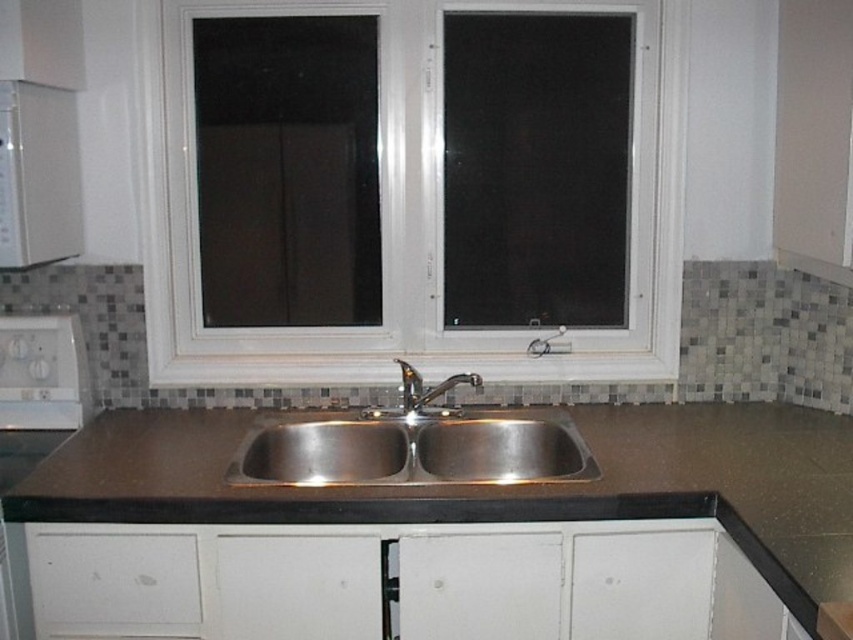
Question: Estimate the real-world distances between objects in this image. Which object is closer to the white plastic window at center?

Choices:
 (A) white matte drawer at lower left
 (B) brown laminate countertop at center
 (C) polished stainless steel faucet at center
 (D) white glossy dishwasher at lower left

Answer: (C)

Question: Among these objects, which one is nearest to the camera?

Choices:
 (A) polished stainless steel faucet at center
 (B) white glossy dishwasher at lower left
 (C) stainless steel sink at center
 (D) white plastic window at center

Answer: (B)

Question: Does white glossy microwave at upper left appear on the left side of polished stainless steel faucet at center?

Choices:
 (A) no
 (B) yes

Answer: (B)

Question: Which of the following is the farthest from the observer?

Choices:
 (A) (404, 362)
 (B) (59, 180)
 (C) (567, 435)

Answer: (A)

Question: Is white plastic window at center to the right of stainless steel sink at center from the viewer's perspective?

Choices:
 (A) yes
 (B) no

Answer: (A)

Question: Observing the image, what is the correct spatial positioning of white plastic window at center in reference to white matte drawer at lower left?

Choices:
 (A) above
 (B) below

Answer: (A)